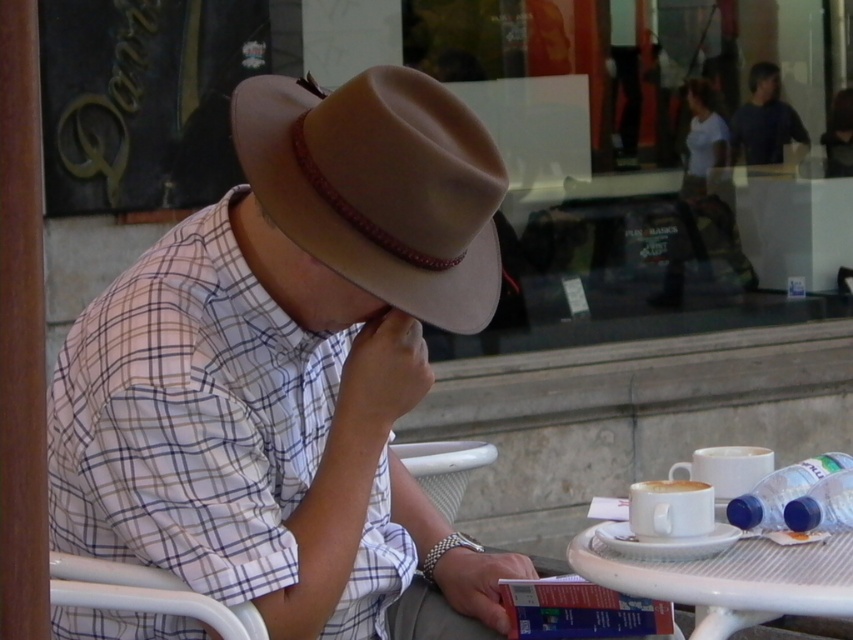
Who is taller, white plastic table at lower right or white matte cup at lower right?

white plastic table at lower right

Does white plastic table at lower right have a greater height compared to white matte cup at lower right?

Yes, white plastic table at lower right is taller than white matte cup at lower right.

Image resolution: width=853 pixels, height=640 pixels. Identify the location of white plastic table at lower right. point(732,580).

Does point (352, 276) lie behind point (695, 483)?

No, (352, 276) is closer to viewer.

Who is positioned more to the right, suede brown fedora at center or white matte cup at lower right?

Positioned to the right is white matte cup at lower right.

Is point (363, 228) farther from viewer compared to point (708, 496)?

No, it is not.

Find the location of a particular element. The width and height of the screenshot is (853, 640). suede brown fedora at center is located at coordinates (380, 186).

Between matte brown hat at center and suede brown fedora at center, which one is positioned higher?

Positioned higher is suede brown fedora at center.

Between matte brown hat at center and suede brown fedora at center, which one has more height?

With more height is matte brown hat at center.

Identify the location of matte brown hat at center. This screenshot has width=853, height=640. (289, 364).